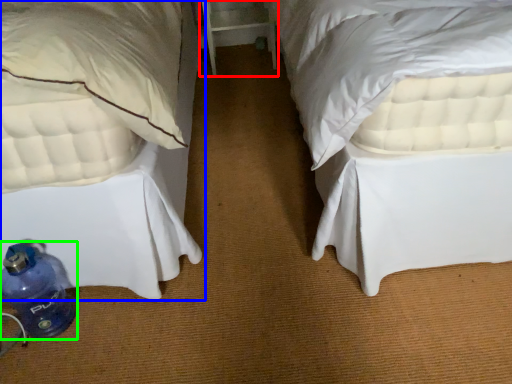
Question: Which is farther away from table (highlighted by a red box)? bed (highlighted by a blue box) or bottle (highlighted by a green box)?

Choices:
 (A) bed
 (B) bottle

Answer: (B)